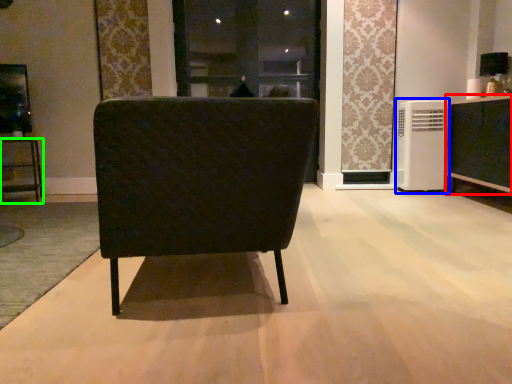
Question: Which object is the closest to the cabinetry (highlighted by a red box)? Choose among these: air conditioner (highlighted by a blue box) or furniture (highlighted by a green box).

Choices:
 (A) air conditioner
 (B) furniture

Answer: (A)